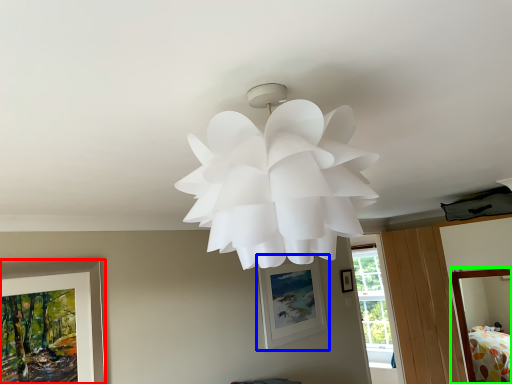
Question: Considering the real-world distances, which object is farthest from picture frame (highlighted by a red box)? picture frame (highlighted by a blue box) or bed (highlighted by a green box)?

Choices:
 (A) picture frame
 (B) bed

Answer: (B)